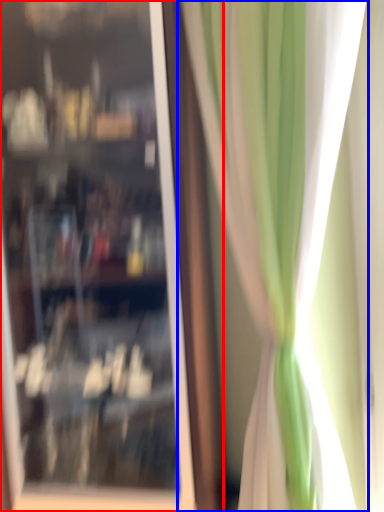
Question: Which object is further to the camera taking this photo, shop window (highlighted by a red box) or curtain (highlighted by a blue box)?

Choices:
 (A) shop window
 (B) curtain

Answer: (A)